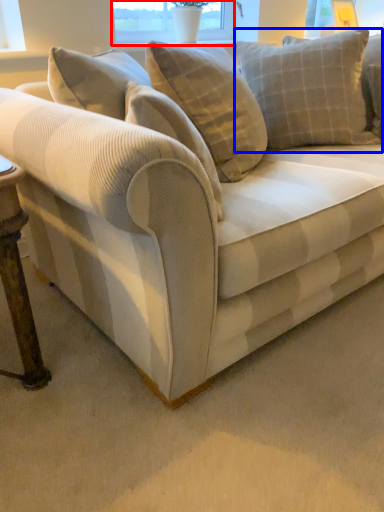
Question: Which point is closer to the camera, window screen (highlighted by a red box) or pillow (highlighted by a blue box)?

Choices:
 (A) window screen
 (B) pillow

Answer: (B)